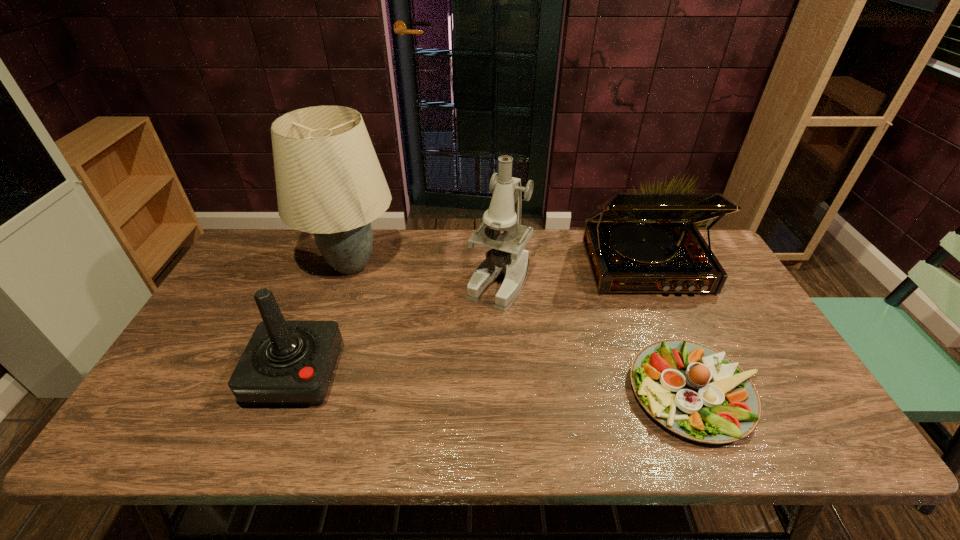
Locate an element on the screen. lampshade is located at coordinates (329, 182).

Image resolution: width=960 pixels, height=540 pixels. I want to click on the fourth shortest object, so click(507, 258).

Locate an element on the screen. This screenshot has width=960, height=540. the third object from right to left is located at coordinates (507, 258).

The image size is (960, 540). What are the coordinates of `record player` in the screenshot? It's located at (635, 242).

The width and height of the screenshot is (960, 540). What are the coordinates of `joystick` in the screenshot? It's located at (286, 363).

What are the coordinates of `the shortest object` in the screenshot? It's located at (695, 391).

Where is `blank space located 0.190m on the left of the lampshade`? The height and width of the screenshot is (540, 960). blank space located 0.190m on the left of the lampshade is located at coordinates (244, 265).

Image resolution: width=960 pixels, height=540 pixels. In order to click on free space located 0.090m on the front of the microscope in this screenshot , I will do `click(501, 335)`.

Find the location of `vacant space located 0.400m on the front-facing side of the record player`. vacant space located 0.400m on the front-facing side of the record player is located at coordinates [x=713, y=421].

Find the location of a particular element. vacant space positioned 0.080m on the front-facing side of the joystick is located at coordinates (270, 443).